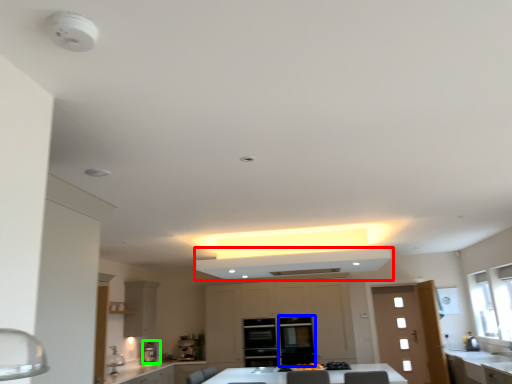
Question: Based on their relative distances, which object is nearer to exhaust hood (highlighted by a red box)? Choose from glass door (highlighted by a blue box) and coffee machine (highlighted by a green box).

Choices:
 (A) glass door
 (B) coffee machine

Answer: (A)